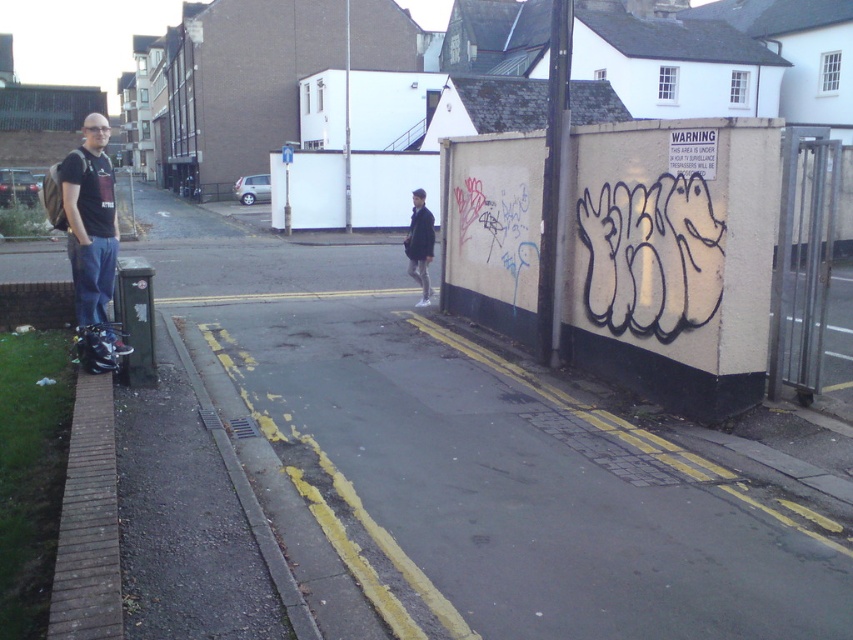
Question: Can you confirm if matte black t-shirt at left is positioned below dark gray jacket at center?

Choices:
 (A) no
 (B) yes

Answer: (B)

Question: Which point is farther to the camera?

Choices:
 (A) (410, 273)
 (B) (57, 168)

Answer: (A)

Question: Is matte black t-shirt at left smaller than dark gray jacket at center?

Choices:
 (A) no
 (B) yes

Answer: (B)

Question: Does matte black t-shirt at left have a smaller size compared to dark gray jacket at center?

Choices:
 (A) yes
 (B) no

Answer: (A)